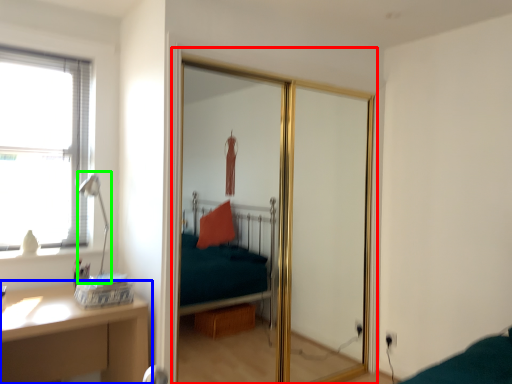
Question: Which object is positioned closest to screen door (highlighted by a red box)? Select from table (highlighted by a blue box) and table lamp (highlighted by a green box).

Choices:
 (A) table
 (B) table lamp

Answer: (A)